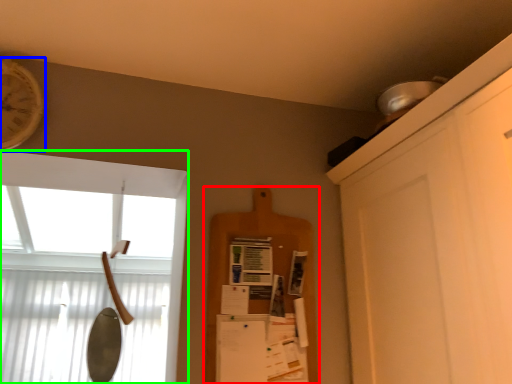
Question: Estimate the real-world distances between objects in this image. Which object is farther from shelf (highlighted by a red box), clock (highlighted by a blue box) or window (highlighted by a green box)?

Choices:
 (A) clock
 (B) window

Answer: (B)